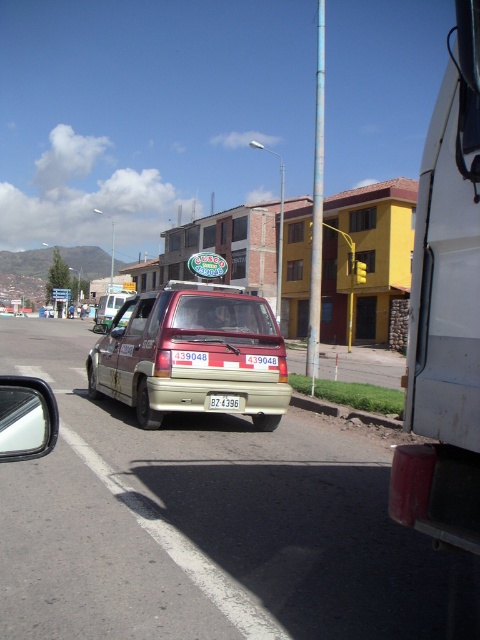
Who is shorter, white matte van at right or beige matte van at center?

Standing shorter between the two is beige matte van at center.

Is point (474, 438) positioned behind point (103, 305)?

No, (474, 438) is closer to viewer.

Image resolution: width=480 pixels, height=640 pixels. Identify the location of white matte van at right. (445, 314).

Is point (157, 396) positioned before point (219, 397)?

Yes, it is in front of point (219, 397).

Between point (220, 317) and point (233, 397), which one is positioned behind?

Point (220, 317)

Identify the location of gold metallic van at center. The width and height of the screenshot is (480, 640). (192, 355).

From the picture: Can you confirm if beige matte van at center is positioned to the right of white plastic license plate at center?

No, beige matte van at center is not to the right of white plastic license plate at center.

Between beige matte van at center and white plastic license plate at center, which one has more height?

Standing taller between the two is beige matte van at center.

Does point (117, 310) come closer to viewer compared to point (218, 408)?

No, (117, 310) is further to viewer.

The image size is (480, 640). I want to click on beige matte van at center, so click(x=108, y=308).